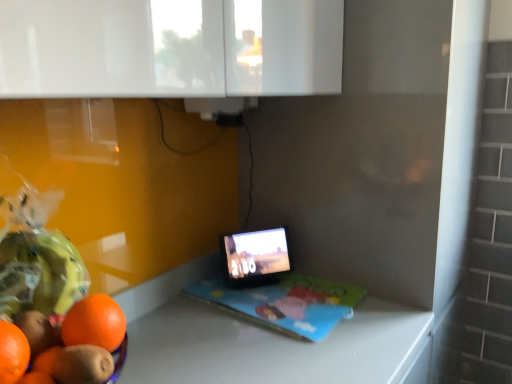
Question: Would you say matte black laptop at center is to the left or to the right of black glossy tablet at center in the picture?

Choices:
 (A) left
 (B) right

Answer: (B)

Question: From their relative heights in the image, would you say matte black laptop at center is taller or shorter than black glossy tablet at center?

Choices:
 (A) short
 (B) tall

Answer: (A)

Question: From a real-world perspective, relative to black glossy tablet at center, is matte black laptop at center vertically above or below?

Choices:
 (A) below
 (B) above

Answer: (A)

Question: From a real-world perspective, is black glossy tablet at center positioned above or below matte black laptop at center?

Choices:
 (A) above
 (B) below

Answer: (A)

Question: Considering the positions of point (263, 248) and point (344, 316), is point (263, 248) closer or farther from the camera than point (344, 316)?

Choices:
 (A) closer
 (B) farther

Answer: (B)

Question: From the image's perspective, is black glossy tablet at center positioned above or below matte black laptop at center?

Choices:
 (A) below
 (B) above

Answer: (B)

Question: Is black glossy tablet at center taller or shorter than matte black laptop at center?

Choices:
 (A) short
 (B) tall

Answer: (B)